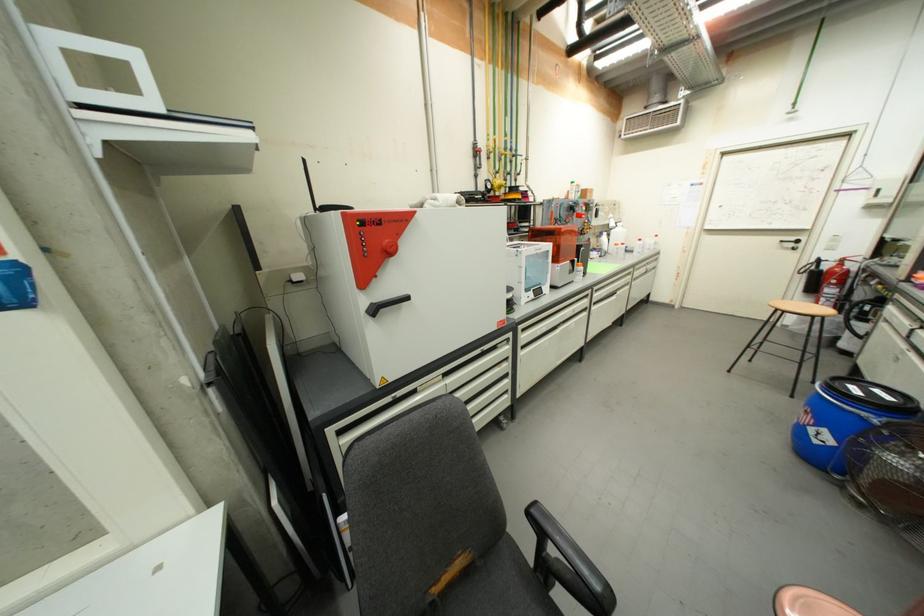
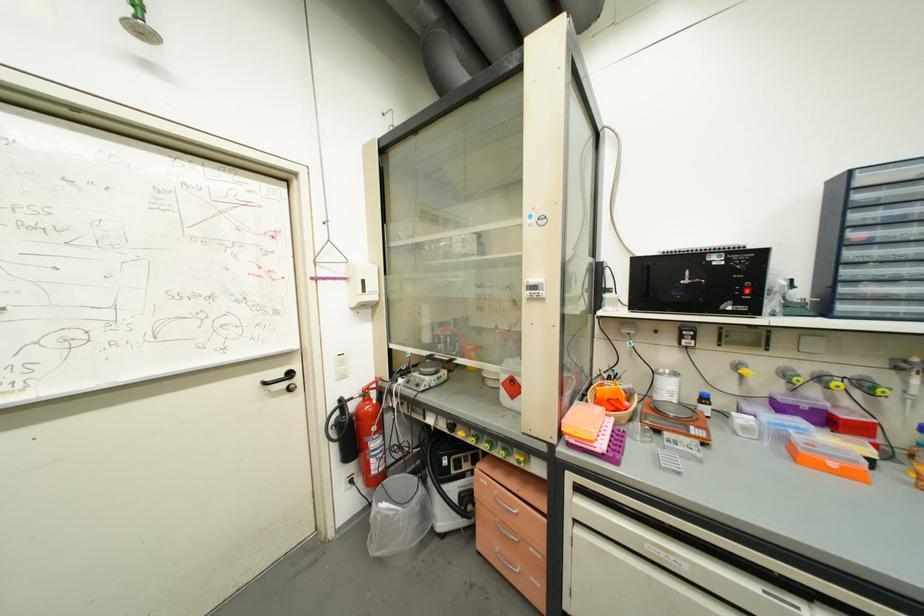
The point at (832, 268) is marked in the first image. Where is the corresponding point in the second image?

(358, 408)